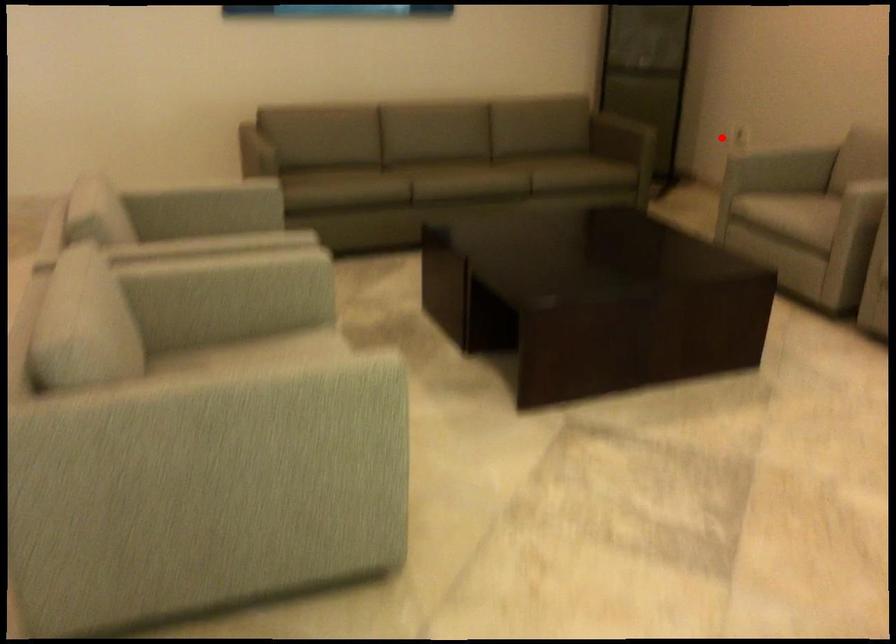
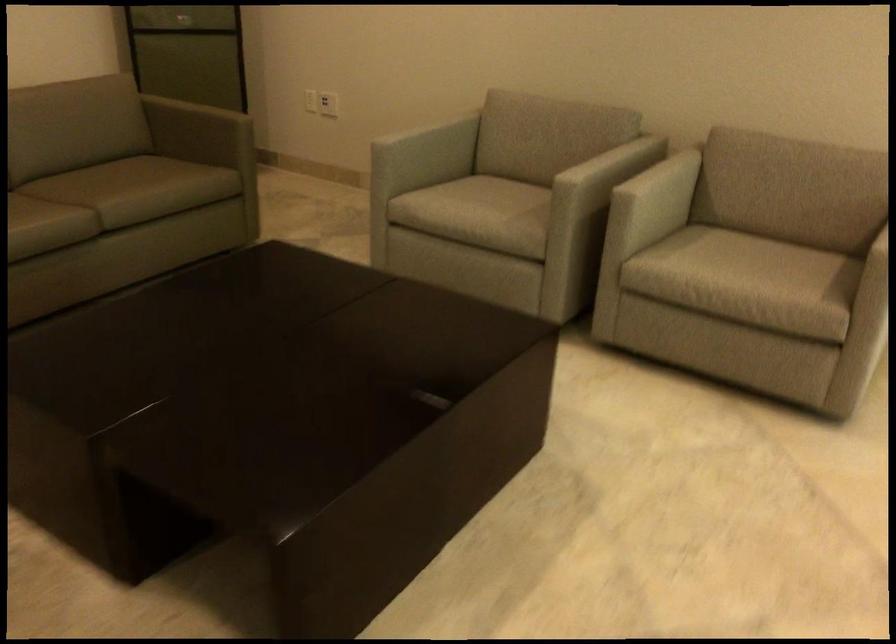
Where in the second image is the point corresponding to the highlighted location from the first image?

(328, 104)